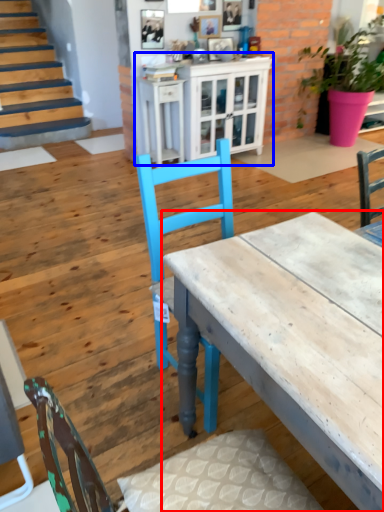
Question: Which point is closer to the camera, desk (highlighted by a red box) or cabinetry (highlighted by a blue box)?

Choices:
 (A) desk
 (B) cabinetry

Answer: (A)